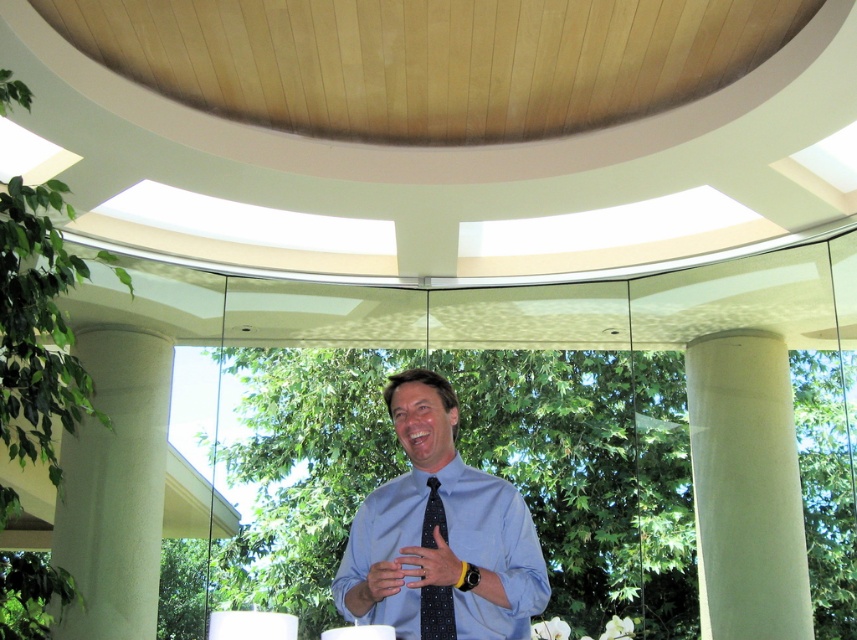
Is point (115, 385) positioned before point (382, 576)?

No, (115, 385) is further to viewer.

Who is taller, white smooth column at left or smooth skin hand at center?

white smooth column at left is taller.

What are the coordinates of `white smooth column at left` in the screenshot? It's located at (115, 486).

In order to click on white smooth column at left in this screenshot , I will do (115, 486).

Who is more forward, (400, 534) or (732, 506)?

Point (400, 534) is in front.

Is blue polka dot tie at center in front of white smooth column at center?

Yes, it is.

Measure the distance between point (x=399, y=625) and camera.

A distance of 1.94 meters exists between point (x=399, y=625) and camera.

The height and width of the screenshot is (640, 857). What are the coordinates of `blue polka dot tie at center` in the screenshot? It's located at (442, 532).

What do you see at coordinates (442, 532) in the screenshot?
I see `blue polka dot tie at center` at bounding box center [442, 532].

This screenshot has height=640, width=857. Describe the element at coordinates (442, 532) in the screenshot. I see `blue polka dot tie at center` at that location.

What are the coordinates of `blue polka dot tie at center` in the screenshot? It's located at (442, 532).